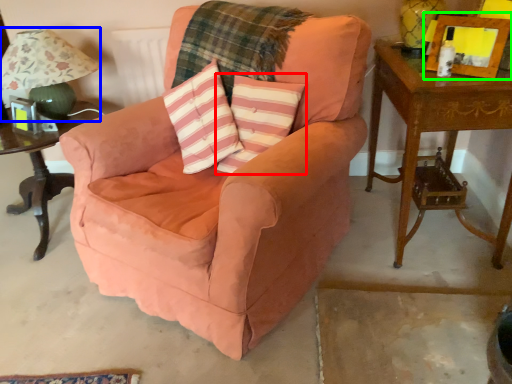
Question: Which object is the closest to the throw pillow (highlighted by a red box)? Choose among these: table lamp (highlighted by a blue box) or picture frame (highlighted by a green box).

Choices:
 (A) table lamp
 (B) picture frame

Answer: (B)